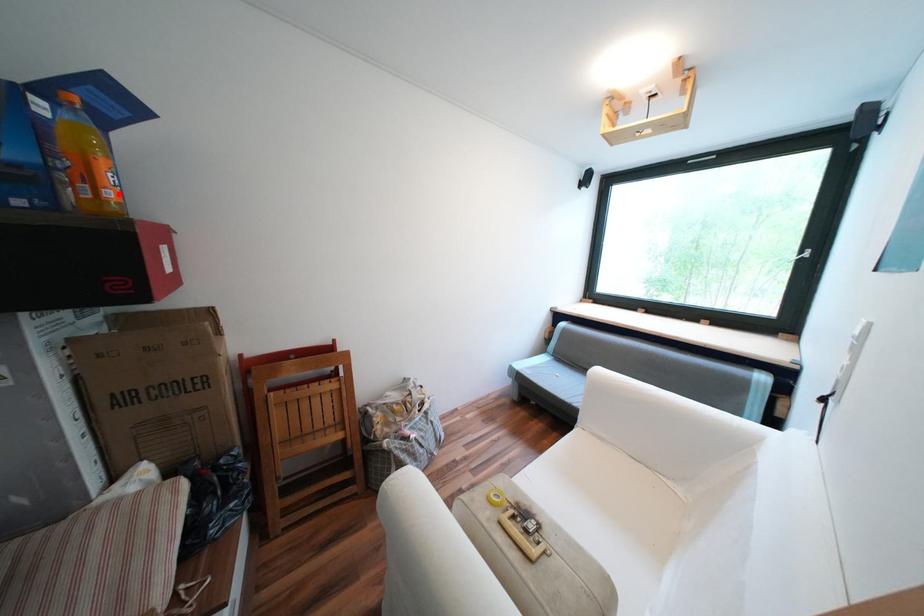
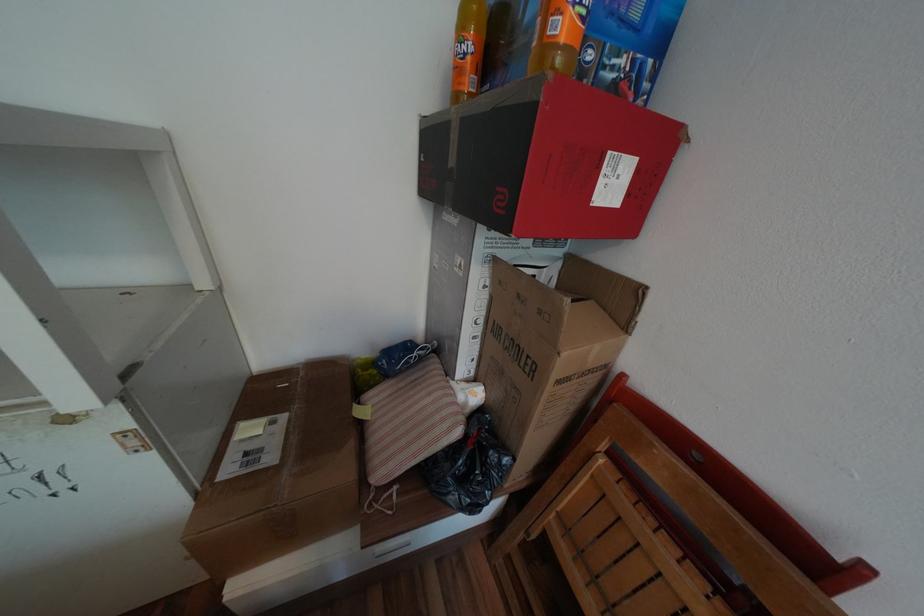
Find the pixel in the second image that matches the highlighted location in the first image.

(569, 26)